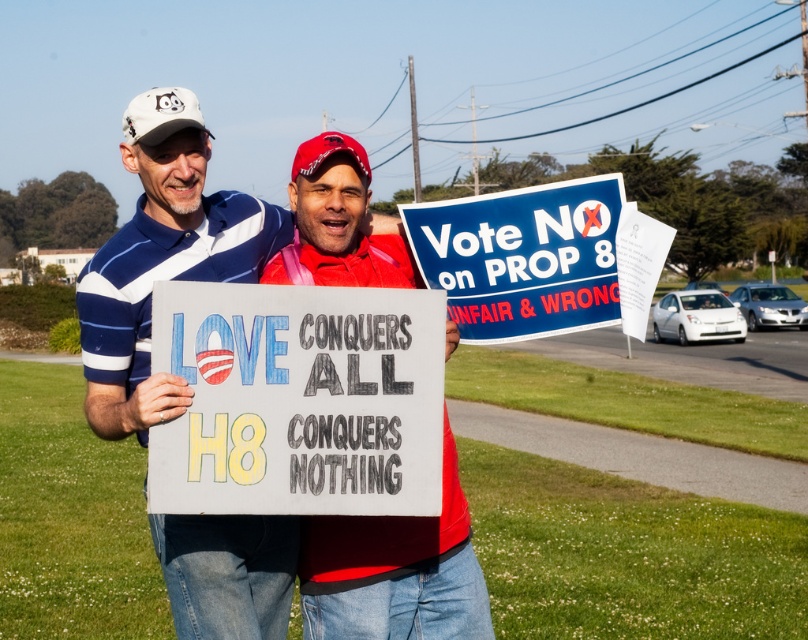
Question: Estimate the real-world distances between objects in this image. Which object is closer to the hand-drawn paper sign at center?

Choices:
 (A) white plastic sign at center
 (B) blue paper sign at upper center

Answer: (A)

Question: Which point is farther to the camera?

Choices:
 (A) (259, 358)
 (B) (524, 241)
 (C) (131, 234)

Answer: (C)

Question: Which of the following is the farthest from the observer?

Choices:
 (A) white plastic sign at center
 (B) blue paper sign at upper center

Answer: (B)

Question: Does hand-drawn paper sign at center appear under white plastic sign at center?

Choices:
 (A) no
 (B) yes

Answer: (A)

Question: Observing the image, what is the correct spatial positioning of white plastic sign at center in reference to blue paper sign at upper center?

Choices:
 (A) right
 (B) left

Answer: (B)

Question: Is white plastic sign at center smaller than blue paper sign at upper center?

Choices:
 (A) yes
 (B) no

Answer: (B)